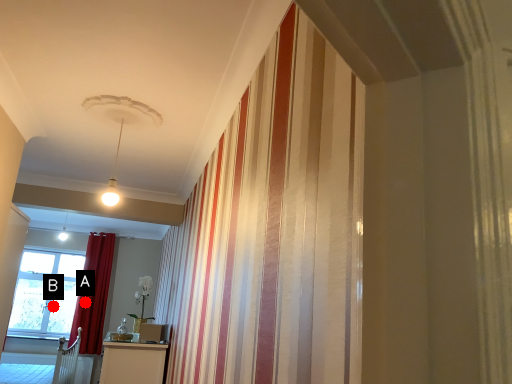
Question: Two points are circled on the image, labeled by A and B beside each circle. Which point appears closest to the camera in this image?

Choices:
 (A) A is closer
 (B) B is closer

Answer: (A)